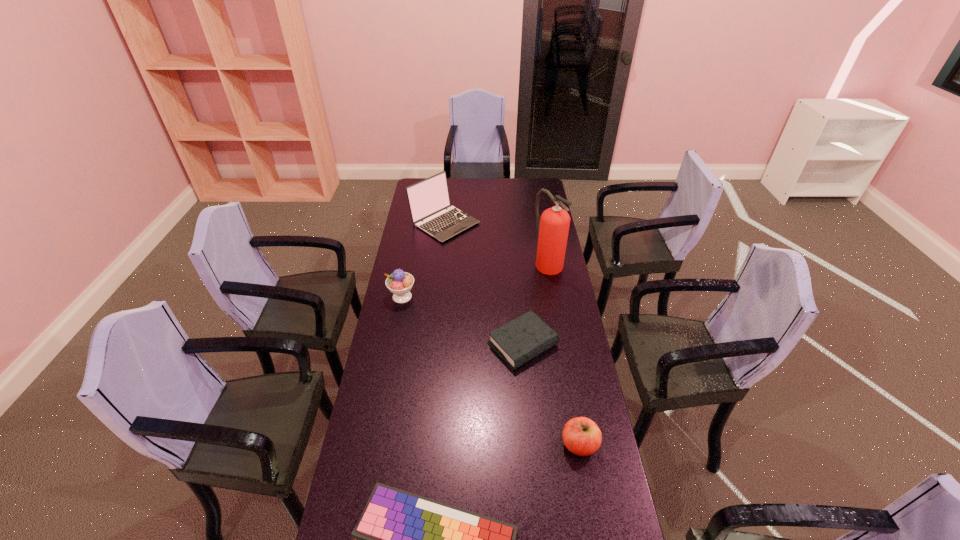
Find the location of `vacant space situated on the handle side of the fire extinguisher`. vacant space situated on the handle side of the fire extinguisher is located at coordinates (554, 296).

The image size is (960, 540). What are the coordinates of `vacant point located at the front screen of the fifth shortest object` in the screenshot? It's located at coord(438,291).

At what (x,y) coordinates should I click in order to perform the action: click on blank space located on the front of the fourth nearest object. Please return your answer as a coordinate pair (x, y). Looking at the image, I should click on (386, 379).

Locate an element on the screen. The image size is (960, 540). vacant space located 0.210m on the front of the second nearest object is located at coordinates (596, 537).

The image size is (960, 540). I want to click on free region located 0.400m on the back of the third nearest object, so click(x=515, y=259).

Find the location of `laptop_computer that is at the left edge`. laptop_computer that is at the left edge is located at coordinates (428, 199).

In order to click on icecream at the left edge in this screenshot , I will do `click(400, 283)`.

In order to click on fire extinguisher that is at the right edge in this screenshot , I will do `click(553, 227)`.

This screenshot has width=960, height=540. What are the coordinates of `apple that is positioned at the right edge` in the screenshot? It's located at (581, 436).

Find the location of a particular element. The width and height of the screenshot is (960, 540). Bible that is at the right edge is located at coordinates (520, 340).